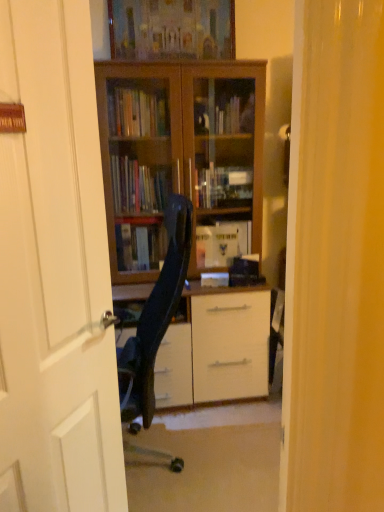
The height and width of the screenshot is (512, 384). I want to click on white wooden door at center, so click(55, 269).

Where is `black leather chair at center`? black leather chair at center is located at coordinates (155, 318).

In order to face wooden bookcase at center, should I rotate leftwards or rightwards?

It's best to rotate left around 0.680 degrees.

The width and height of the screenshot is (384, 512). Find the location of `wooden picture frame at upper center`. wooden picture frame at upper center is located at coordinates (171, 29).

Locate an element on the screen. white wooden door at center is located at coordinates (55, 269).

Considering the sizes of objects wooden picture frame at upper center and black leather chair at center in the image provided, who is taller, wooden picture frame at upper center or black leather chair at center?

black leather chair at center is taller.

From the image's perspective, which one is positioned lower, wooden picture frame at upper center or black leather chair at center?

black leather chair at center is shown below in the image.

Is the surface of wooden picture frame at upper center in direct contact with black leather chair at center?

wooden picture frame at upper center is not next to black leather chair at center, and they're not touching.

Looking at this image, is wooden picture frame at upper center aimed at black leather chair at center?

No, wooden picture frame at upper center is not aimed at black leather chair at center.

Is black leather chair at center facing away from wooden bookcase at center?

No, wooden bookcase at center is not at the back of black leather chair at center.

Can you tell me how much black leather chair at center and wooden bookcase at center differ in facing direction?

The angle between the facing direction of black leather chair at center and the facing direction of wooden bookcase at center is 89.3 degrees.

Does black leather chair at center have a lesser width compared to wooden bookcase at center?

Yes.

Are black leather chair at center and wooden bookcase at center beside each other?

black leather chair at center and wooden bookcase at center are not in contact.

Is white wooden door at center completely or partially inside wooden bookcase at center?

No, white wooden door at center is located outside of wooden bookcase at center.

Find the location of a particular element. bookcase lying on the right of white wooden door at center is located at coordinates (181, 159).

From the image's perspective, is wooden bookcase at center on white wooden door at center?

Indeed, from the image's perspective, wooden bookcase at center is shown above white wooden door at center.

Is wooden bookcase at center closer to the viewer compared to white wooden door at center?

No, wooden bookcase at center is further to the viewer.

From the image's perspective, which one is positioned lower, wooden bookcase at center or black leather chair at center?

black leather chair at center is shown below in the image.

Is wooden bookcase at center oriented away from black leather chair at center?

No, black leather chair at center is not at the back of wooden bookcase at center.

Are wooden bookcase at center and black leather chair at center making contact?

No, wooden bookcase at center is not next to black leather chair at center.

The height and width of the screenshot is (512, 384). In order to click on picture frame behind the wooden bookcase at center in this screenshot , I will do `click(171, 29)`.

Is wooden picture frame at upper center not inside wooden bookcase at center?

Yes, wooden picture frame at upper center is located beyond the bounds of wooden bookcase at center.

Is wooden picture frame at upper center oriented towards wooden bookcase at center?

No.

From a real-world perspective, is white wooden door at center above or below wooden picture frame at upper center?

white wooden door at center is situated lower than wooden picture frame at upper center in the real world.

From the image's perspective, does white wooden door at center appear lower than wooden picture frame at upper center?

Yes, from the image's perspective, white wooden door at center is below wooden picture frame at upper center.

Considering the relative sizes of white wooden door at center and wooden picture frame at upper center in the image provided, is white wooden door at center smaller than wooden picture frame at upper center?

No, white wooden door at center is not smaller than wooden picture frame at upper center.

Is white wooden door at center to the right of wooden picture frame at upper center from the viewer's perspective?

In fact, white wooden door at center is to the left of wooden picture frame at upper center.

Is black leather chair at center outside of white wooden door at center?

black leather chair at center lies outside white wooden door at center's area.

From a real-world perspective, is black leather chair at center under white wooden door at center?

Yes, from a real-world perspective, black leather chair at center is under white wooden door at center.

Which object is further away from the camera taking this photo, black leather chair at center or white wooden door at center?

black leather chair at center.

Is black leather chair at center aimed at white wooden door at center?

No, black leather chair at center does not turn towards white wooden door at center.

The height and width of the screenshot is (512, 384). I want to click on picture frame above the black leather chair at center (from the image's perspective), so click(171, 29).

In the image, there is a wooden bookcase at center. Where is `chair below it (from a real-world perspective)`? chair below it (from a real-world perspective) is located at coordinates (155, 318).

Looking at the image, which one is located further to wooden picture frame at upper center, wooden bookcase at center or white wooden door at center?

white wooden door at center is further to wooden picture frame at upper center.

Which object lies nearer to the anchor point white wooden door at center, wooden picture frame at upper center or wooden bookcase at center?

wooden bookcase at center is closer to white wooden door at center.

Estimate the real-world distances between objects in this image. Which object is closer to black leather chair at center, wooden picture frame at upper center or wooden bookcase at center?

wooden bookcase at center lies closer to black leather chair at center than the other object.

When comparing their distances from wooden picture frame at upper center, does wooden bookcase at center or black leather chair at center seem further?

black leather chair at center.

From the image, which object appears to be farther from black leather chair at center, wooden picture frame at upper center or white wooden door at center?

wooden picture frame at upper center is positioned further to the anchor black leather chair at center.

When comparing their distances from black leather chair at center, does white wooden door at center or wooden bookcase at center seem closer?

Among the two, wooden bookcase at center is located nearer to black leather chair at center.

Which object lies nearer to the anchor point white wooden door at center, wooden bookcase at center or black leather chair at center?

black leather chair at center.

When comparing their distances from wooden picture frame at upper center, does white wooden door at center or black leather chair at center seem further?

Among the two, white wooden door at center is located further to wooden picture frame at upper center.

Locate an element on the screen. The image size is (384, 512). chair located between white wooden door at center and wooden bookcase at center in the depth direction is located at coordinates (155, 318).

The height and width of the screenshot is (512, 384). In order to click on bookcase between wooden picture frame at upper center and black leather chair at center from top to bottom in this screenshot , I will do pyautogui.click(x=181, y=159).

Where is `door between wooden picture frame at upper center and black leather chair at center in the up-down direction`? The image size is (384, 512). door between wooden picture frame at upper center and black leather chair at center in the up-down direction is located at coordinates (55, 269).

Identify the location of bookcase between white wooden door at center and wooden picture frame at upper center along the z-axis. (181, 159).